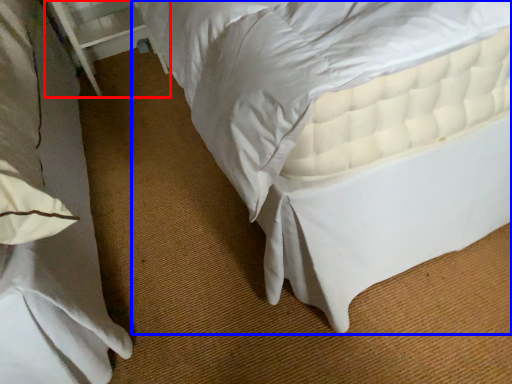
Question: Which point is further to the camera, balustrade (highlighted by a red box) or bed (highlighted by a blue box)?

Choices:
 (A) balustrade
 (B) bed

Answer: (A)